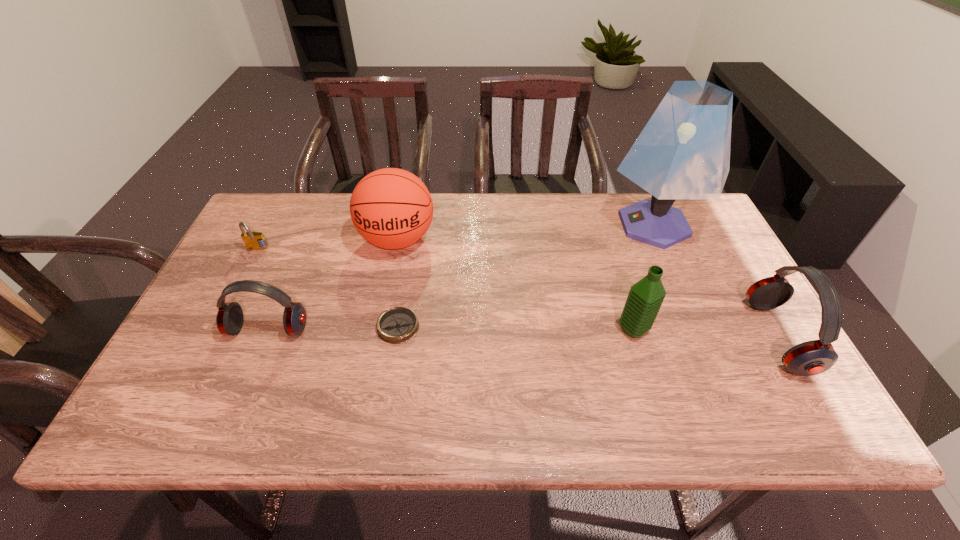
The height and width of the screenshot is (540, 960). In order to click on padlock that is at the left edge in this screenshot , I will do `click(253, 240)`.

Where is `earphone located in the right edge section of the desktop`? earphone located in the right edge section of the desktop is located at coordinates (813, 357).

The width and height of the screenshot is (960, 540). Identify the location of lampshade present at the right edge. (683, 152).

At what (x,y) coordinates should I click in order to perform the action: click on object that is at the far right corner. Please return your answer as a coordinate pair (x, y). Looking at the image, I should click on (683, 152).

Find the location of `object situated at the near right corner`. object situated at the near right corner is located at coordinates (813, 357).

You are a GUI agent. You are given a task and a screenshot of the screen. Output one action in this format:
    pyautogui.click(x=<x>, y=<y>)
    Task: Click on the vacant space at the far edge of the desktop
    The width and height of the screenshot is (960, 540).
    Given the screenshot: What is the action you would take?
    pyautogui.click(x=345, y=211)

Locate an element on the screen. This screenshot has width=960, height=540. vacant area at the near edge is located at coordinates (692, 390).

Identify the location of free space at the far left corner. (274, 214).

This screenshot has width=960, height=540. What are the coordinates of `blank space at the near left corner of the desktop` in the screenshot? It's located at (183, 370).

The height and width of the screenshot is (540, 960). I want to click on vacant point located between the basketball and the water bottle, so click(x=516, y=285).